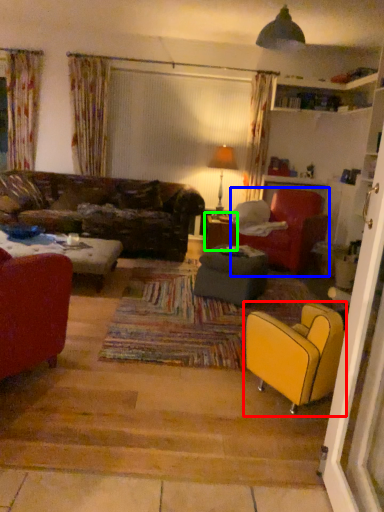
Question: Considering the real-world distances, which object is closest to chair (highlighted by a red box)? chair (highlighted by a blue box) or table (highlighted by a green box).

Choices:
 (A) chair
 (B) table

Answer: (A)